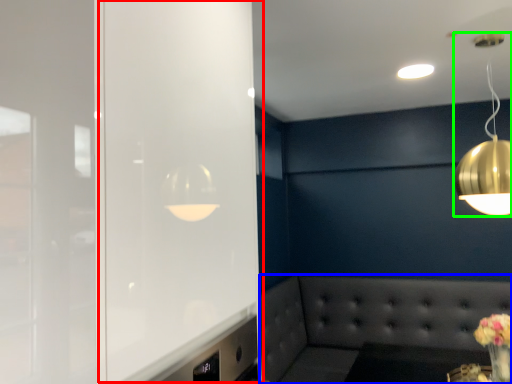
Question: Which object is positioned farthest from glass door (highlighted by a red box)? Select from couch (highlighted by a blue box) and lamp (highlighted by a green box).

Choices:
 (A) couch
 (B) lamp

Answer: (A)